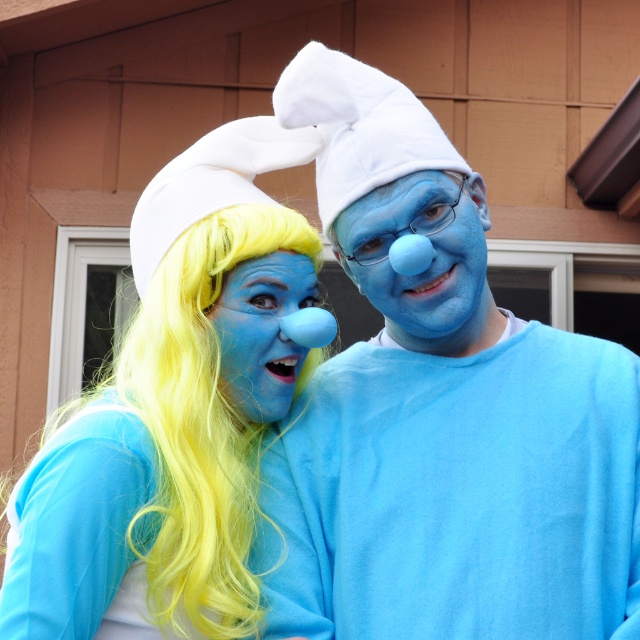
You are a photographer setting up for a photoshoot with two Smurf characters. You need to position a spotlight so that it shines directly on the taller object between the matte blue costume at center and the yellow synthetic hair at center. Which object should the spotlight be aimed at?

The matte blue costume at center is taller than the yellow synthetic hair at center, so the spotlight should be aimed at the matte blue costume at center.

Looking at this image, you are a costume designer preparing to adjust the size of the matte blue costume at center and the matte blue nose at center for a performance. Based on the image, which object would require more fabric to cover its surface area?

The matte blue costume at center requires more fabric because it is bigger than the matte blue nose at center.

You are standing in front of the Smurfs costume characters in the image. You want to place a small flower pot between the two points marked as point [189,365] and point [330,232]. Which point should the flower pot be closer to if you want it to appear closer to the viewer?

The flower pot should be placed closer to point [189,365] because it is closer to the viewer than point [330,232].